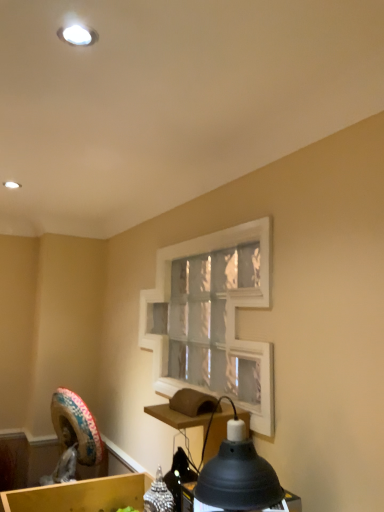
Question: Based on their positions, is matte black lampshade at lower center located to the left or right of white matte window frame at center?

Choices:
 (A) right
 (B) left

Answer: (A)

Question: From a real-world perspective, is matte black lampshade at lower center physically located above or below white matte window frame at center?

Choices:
 (A) above
 (B) below

Answer: (B)

Question: Which object is the farthest from the matte black lampshade at lower center?

Choices:
 (A) white matte window frame at center
 (B) wooden cardboard box at lower left

Answer: (B)

Question: Which is nearer to the matte black lampshade at lower center?

Choices:
 (A) wooden cardboard box at lower left
 (B) white matte window frame at center

Answer: (B)